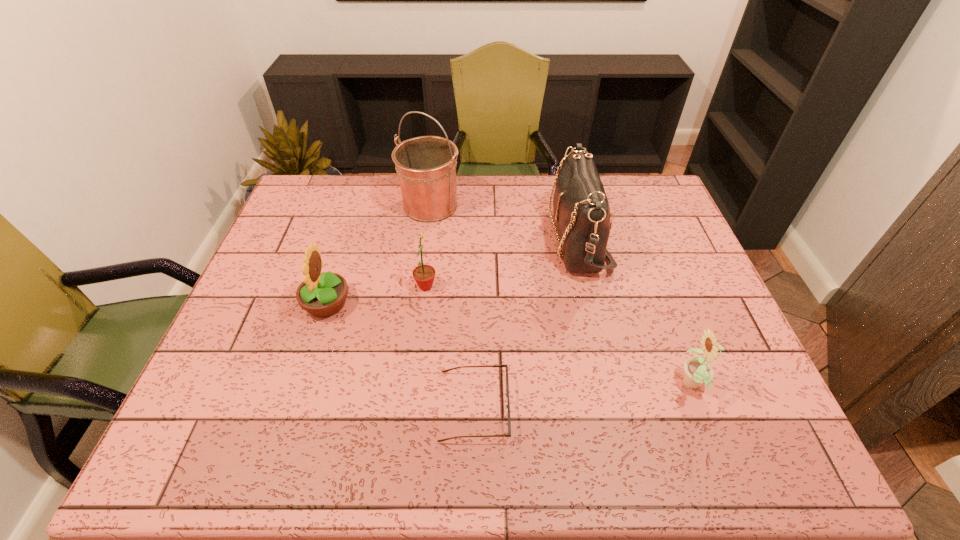
Locate an element on the screen. object located at the near edge is located at coordinates (507, 406).

Find the location of a particular element. Image resolution: width=960 pixels, height=540 pixels. object that is at the left edge is located at coordinates (324, 294).

Identify the location of object that is at the right edge. (697, 371).

The image size is (960, 540). I want to click on free space at the far edge of the desktop, so click(x=514, y=185).

In the image, there is a desktop. Identify the location of vacant space at the near edge. (671, 457).

Image resolution: width=960 pixels, height=540 pixels. In the image, there is a desktop. Identify the location of vacant space at the left edge. (222, 342).

At what (x,y) coordinates should I click in order to perform the action: click on vacant space at the right edge of the desktop. Please return your answer as a coordinate pair (x, y). Looking at the image, I should click on (684, 266).

Locate an element on the screen. The height and width of the screenshot is (540, 960). vacant area at the far left corner is located at coordinates (296, 193).

At what (x,y) coordinates should I click in order to perform the action: click on free space between the shortest object and the second sunflower from right to left. Please return your answer as a coordinate pair (x, y). Looking at the image, I should click on click(x=450, y=346).

You are a GUI agent. You are given a task and a screenshot of the screen. Output one action in this format:
    pyautogui.click(x=<x>, y=<y>)
    Task: Click on the free spot between the rightmost sunflower and the tallest object
    This screenshot has width=960, height=540.
    Given the screenshot: What is the action you would take?
    (x=562, y=295)